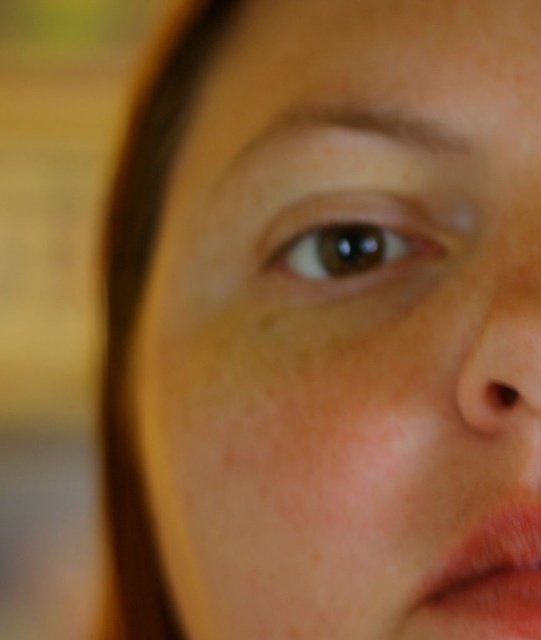
Can you confirm if pink matte lips at lower right is positioned below smooth skin nose at right?

Indeed, pink matte lips at lower right is positioned under smooth skin nose at right.

The width and height of the screenshot is (541, 640). What do you see at coordinates (486, 580) in the screenshot?
I see `pink matte lips at lower right` at bounding box center [486, 580].

Where is `pink matte lips at lower right`? Image resolution: width=541 pixels, height=640 pixels. pink matte lips at lower right is located at coordinates (486, 580).